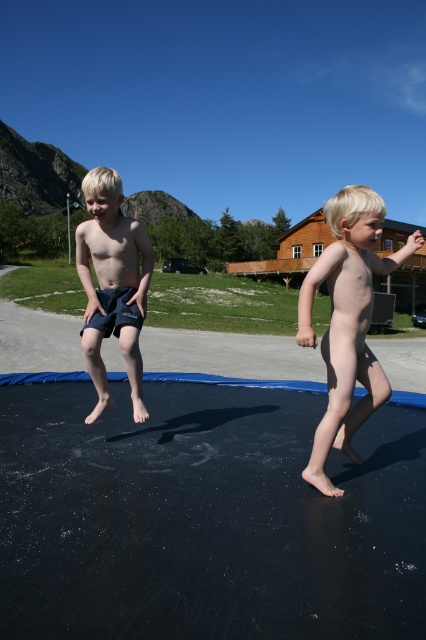
Question: Observing the image, what is the correct spatial positioning of nude skin at center in reference to dark blue shorts at left?

Choices:
 (A) below
 (B) above

Answer: (A)

Question: Where is nude skin at center located in relation to dark blue shorts at left in the image?

Choices:
 (A) right
 (B) left

Answer: (A)

Question: Which object appears farthest from the camera in this image?

Choices:
 (A) dark blue shorts at left
 (B) nude skin at center

Answer: (A)

Question: Does nude skin at center have a greater width compared to dark blue shorts at left?

Choices:
 (A) yes
 (B) no

Answer: (A)

Question: Which of the following is the farthest from the observer?

Choices:
 (A) (108, 397)
 (B) (371, 225)

Answer: (A)